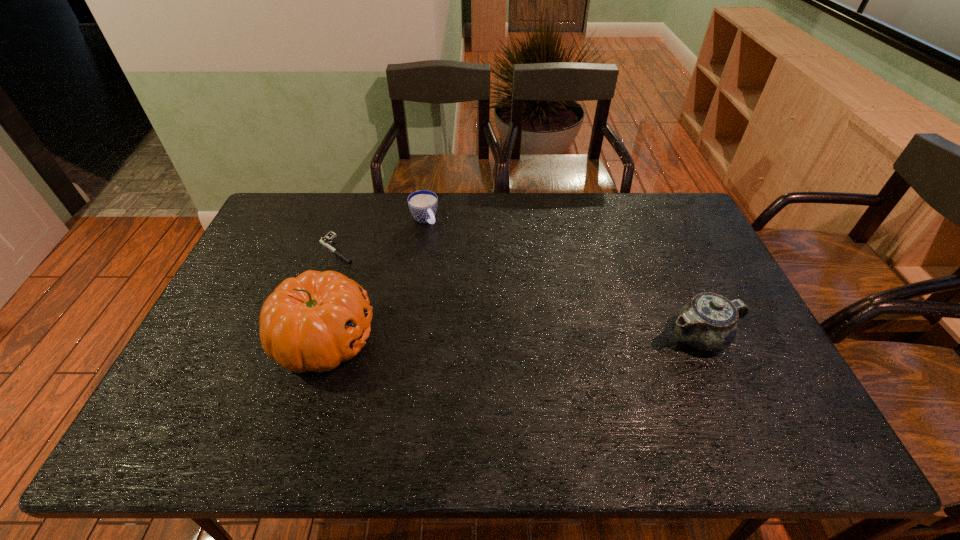
This screenshot has width=960, height=540. Identify the location of free space located on the side of the second shortest object with the handle. click(x=448, y=251).

The height and width of the screenshot is (540, 960). I want to click on blank area located on the front-facing side of the shortest object, so click(382, 282).

Where is `free space located on the front-facing side of the shortest object`? The height and width of the screenshot is (540, 960). free space located on the front-facing side of the shortest object is located at coordinates (437, 320).

This screenshot has width=960, height=540. Identify the location of blank space located 0.210m on the front-facing side of the shortest object. (393, 290).

Identify the location of object positioned at the far edge. (423, 204).

Locate an element on the screen. This screenshot has height=540, width=960. object that is positioned at the near edge is located at coordinates (313, 322).

I want to click on object that is at the right edge, so click(x=708, y=322).

The height and width of the screenshot is (540, 960). I want to click on vacant region at the far edge, so click(x=342, y=204).

Locate an element on the screen. This screenshot has width=960, height=540. free spot at the near edge of the desktop is located at coordinates (249, 378).

You are a GUI agent. You are given a task and a screenshot of the screen. Output one action in this format:
    pyautogui.click(x=<x>, y=<y>)
    Task: Click on the vacant region at the left edge
    
    Given the screenshot: What is the action you would take?
    pyautogui.click(x=223, y=342)